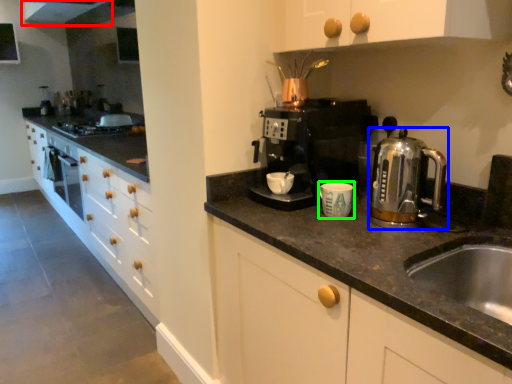
Question: Based on their relative distances, which object is farther from exhaust hood (highlighted by a red box)? Choose from home appliance (highlighted by a blue box) and kitchen appliance (highlighted by a green box).

Choices:
 (A) home appliance
 (B) kitchen appliance

Answer: (B)